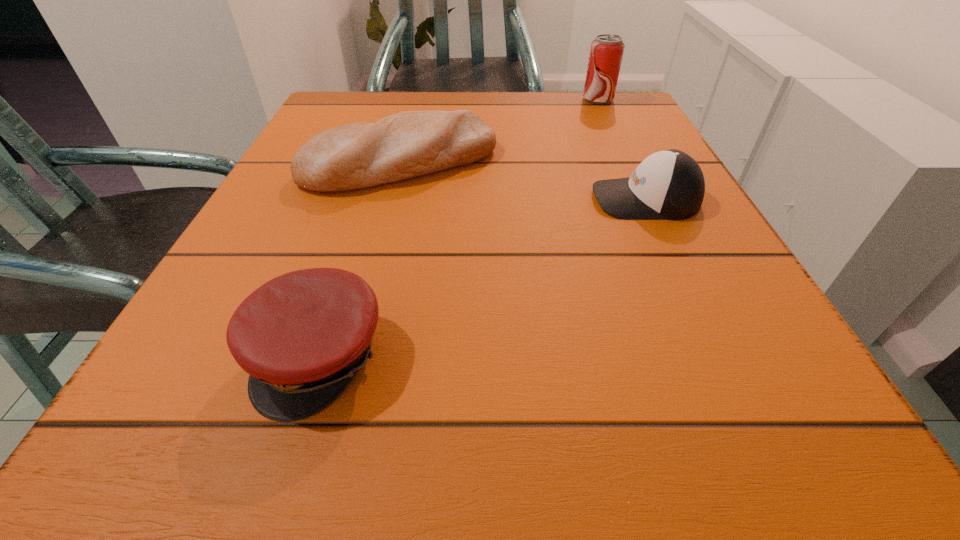
Locate an element on the screen. This screenshot has width=960, height=540. soda can is located at coordinates point(606,52).

Identify the location of the farthest object. (606, 52).

The width and height of the screenshot is (960, 540). In order to click on bread in this screenshot , I will do `click(410, 144)`.

The height and width of the screenshot is (540, 960). Find the location of `the farther cap`. the farther cap is located at coordinates (669, 184).

I want to click on the nearest object, so click(302, 337).

This screenshot has height=540, width=960. I want to click on the left cap, so click(x=302, y=337).

At what (x,y) coordinates should I click in order to perform the action: click on vacant area situated 0.200m on the front of the tallest object. Please return your answer as a coordinate pair (x, y). This screenshot has height=540, width=960. Looking at the image, I should click on (621, 149).

At what (x,y) coordinates should I click in order to perform the action: click on free space located 0.300m on the right of the bread. Please return your answer as a coordinate pair (x, y). Looking at the image, I should click on (660, 161).

Locate an element on the screen. vacant space located on the front panel of the farther cap is located at coordinates (550, 199).

Identify the location of vacant region located on the front panel of the farther cap. The image size is (960, 540). (514, 199).